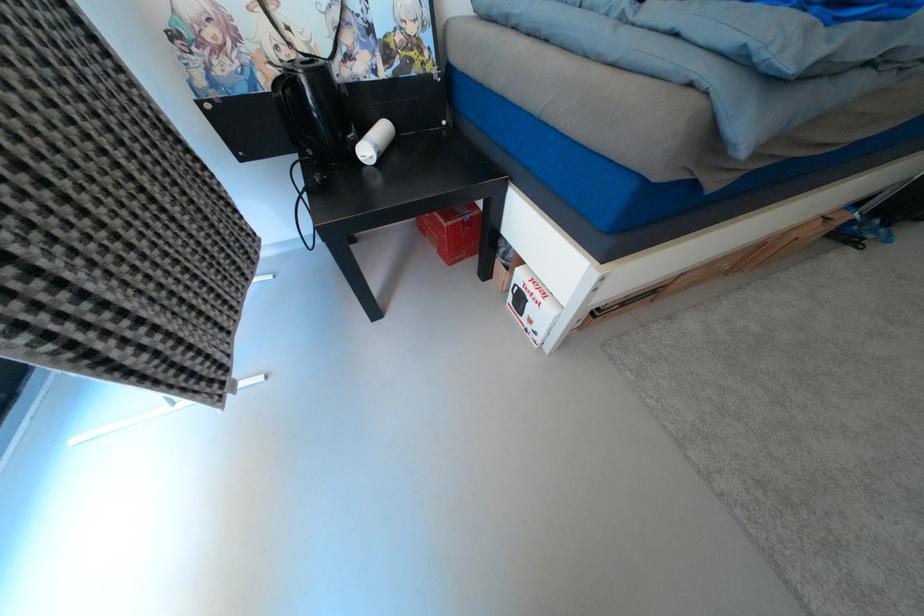
The location [374,142] corresponds to which object?

It refers to a white paper roll.